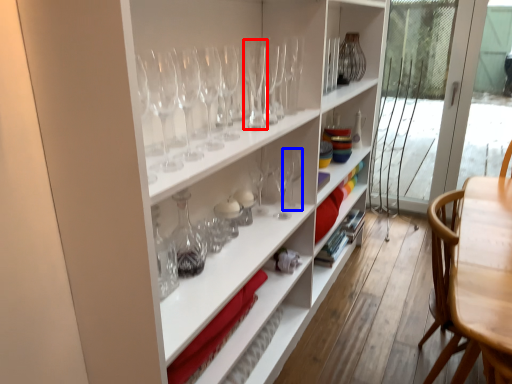
Question: Which point is further to the camera, wine glass (highlighted by a red box) or wine glass (highlighted by a blue box)?

Choices:
 (A) wine glass
 (B) wine glass

Answer: (B)